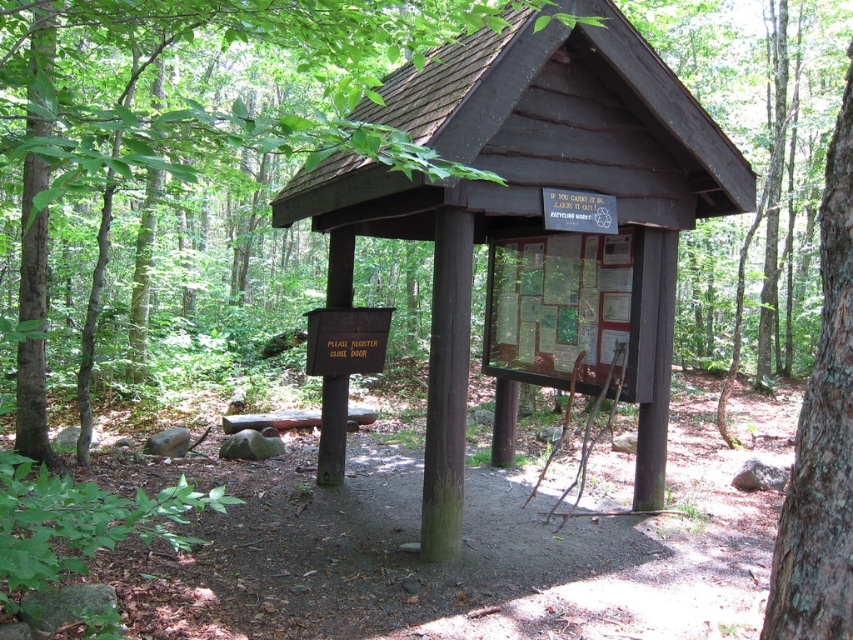
Does point (650, 99) lie in front of point (811, 605)?

No, it is behind (811, 605).

Does point (585, 108) lie behind point (834, 257)?

Yes, point (585, 108) is behind point (834, 257).

Is point (672, 193) positioned after point (828, 316)?

Yes, it is.

You are a GUI agent. You are given a task and a screenshot of the screen. Output one action in this format:
    pyautogui.click(x=<x>, y=<y>)
    Task: Click on the dark brown wood sign at center
    The width and height of the screenshot is (853, 640).
    Given the screenshot: What is the action you would take?
    pyautogui.click(x=532, y=209)

Between brown wood sign at center and brown rough bark tree at right, which one is positioned higher?

brown wood sign at center

Does brown wood sign at center appear on the right side of brown rough bark tree at right?

In fact, brown wood sign at center is to the left of brown rough bark tree at right.

Between point (32, 45) and point (807, 433), which one is positioned in front?

Point (807, 433) is more forward.

Locate an element on the screen. The width and height of the screenshot is (853, 640). brown wood sign at center is located at coordinates (138, 164).

Is point (445, 552) more distant than point (25, 442)?

No, it is not.

Does point (654, 108) come behind point (120, 13)?

Yes, point (654, 108) is farther from viewer.

You are a GUI agent. You are given a task and a screenshot of the screen. Output one action in this format:
    pyautogui.click(x=<x>, y=<y>)
    Task: Click on the dark brown wood sign at center
    This screenshot has width=853, height=640.
    Given the screenshot: What is the action you would take?
    pyautogui.click(x=532, y=209)